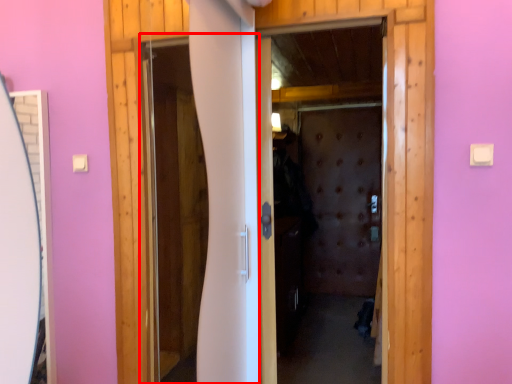
Question: From the image's perspective, what is the correct spatial relationship of screen door (annotated by the red box) in relation to screen door?

Choices:
 (A) below
 (B) above

Answer: (B)